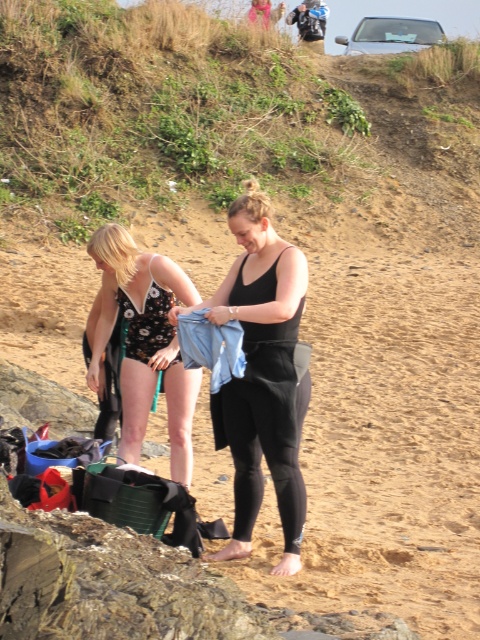
Question: Is black matte tank top at center bigger than black floral swimsuit at left?

Choices:
 (A) no
 (B) yes

Answer: (A)

Question: From the image, what is the correct spatial relationship of black matte tank top at center in relation to black floral swimsuit at left?

Choices:
 (A) right
 (B) left

Answer: (A)

Question: Which point is closer to the camera?

Choices:
 (A) (240, 525)
 (B) (155, 352)

Answer: (A)

Question: Which object appears farthest from the camera in this image?

Choices:
 (A) black floral swimsuit at left
 (B) black matte tank top at center

Answer: (A)

Question: From the image, what is the correct spatial relationship of black matte tank top at center in relation to black floral swimsuit at left?

Choices:
 (A) below
 (B) above

Answer: (A)